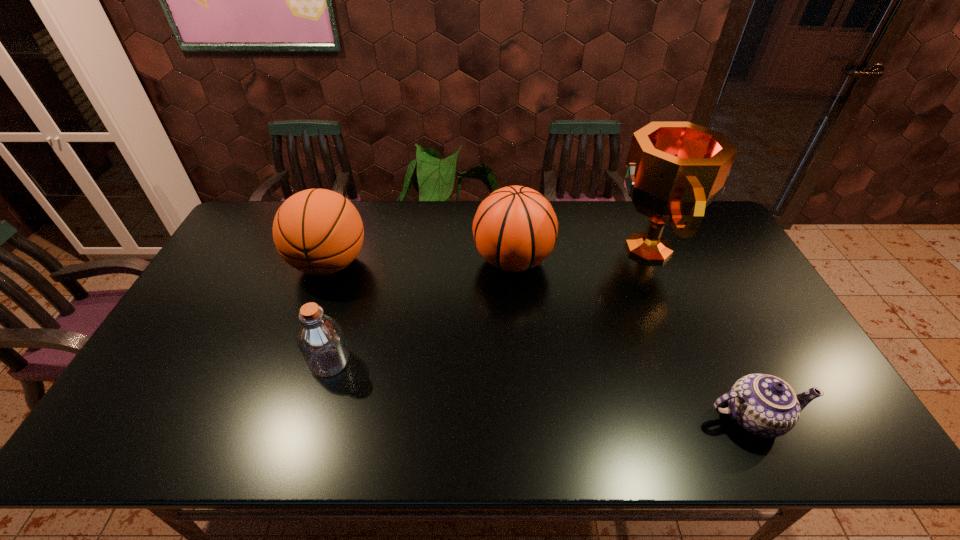
Where is `award`? Image resolution: width=960 pixels, height=540 pixels. award is located at coordinates (674, 170).

Identify the location of the third object from left to right. (515, 228).

Locate an element on the screen. This screenshot has height=540, width=960. the left basketball is located at coordinates (317, 231).

Locate an element on the screen. the fourth farthest object is located at coordinates (320, 339).

Where is `bottle`? The image size is (960, 540). bottle is located at coordinates (320, 339).

Locate an element on the screen. the shortest object is located at coordinates (765, 405).

At what (x,y) coordinates should I click in order to perform the action: click on the nearest object. Please return your answer as a coordinate pair (x, y). The width and height of the screenshot is (960, 540). Looking at the image, I should click on (765, 405).

Where is `vacant region located on the side of the award with the star emblem`? The image size is (960, 540). vacant region located on the side of the award with the star emblem is located at coordinates (563, 249).

This screenshot has height=540, width=960. Find the location of `vacant space situated 0.150m on the side of the award with the star emblem`. vacant space situated 0.150m on the side of the award with the star emblem is located at coordinates (x=563, y=249).

Where is `vacant area situated 0.170m on the side of the award with the star emblem`? vacant area situated 0.170m on the side of the award with the star emblem is located at coordinates (557, 249).